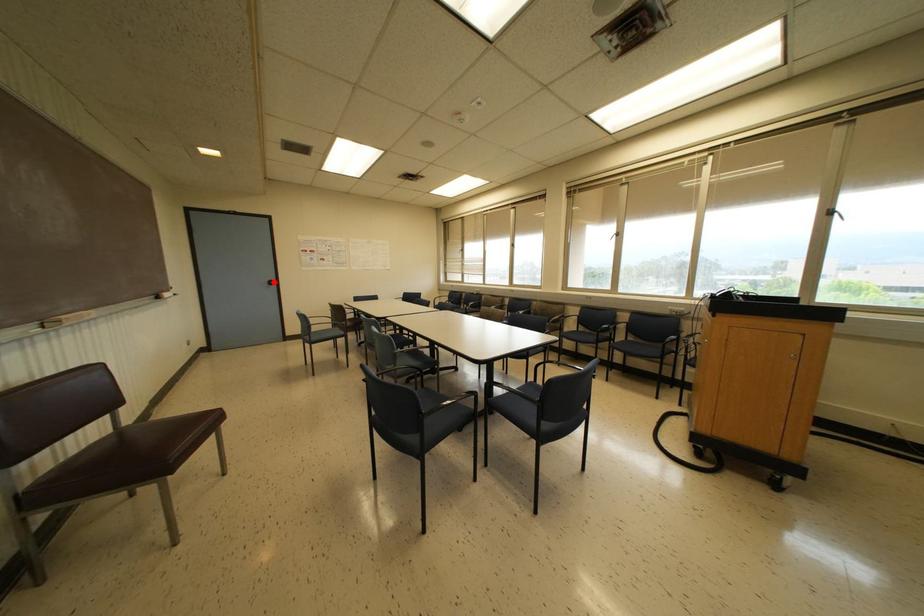
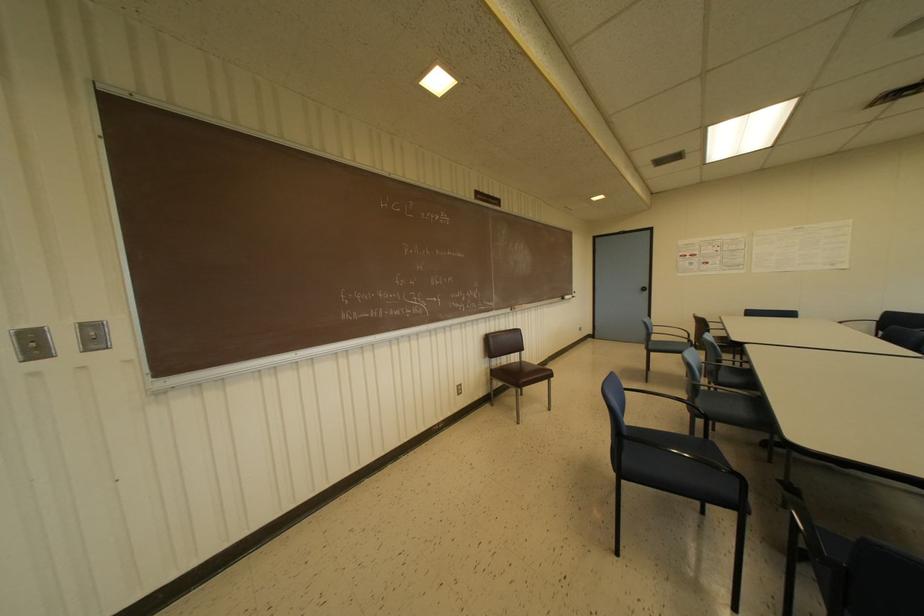
Find the pixel in the second image that matches the highlighted location in the first image.

(646, 288)